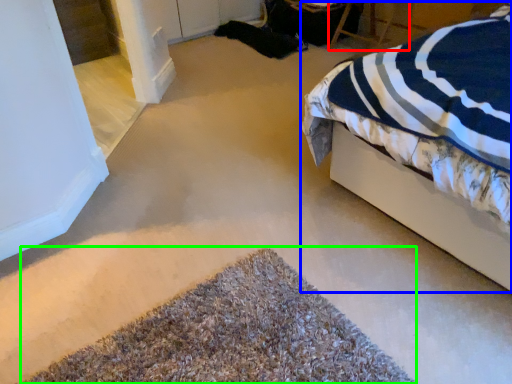
Question: Estimate the real-world distances between objects in this image. Which object is closer to chair (highlighted by a red box), bed (highlighted by a blue box) or door (highlighted by a green box)?

Choices:
 (A) bed
 (B) door

Answer: (A)